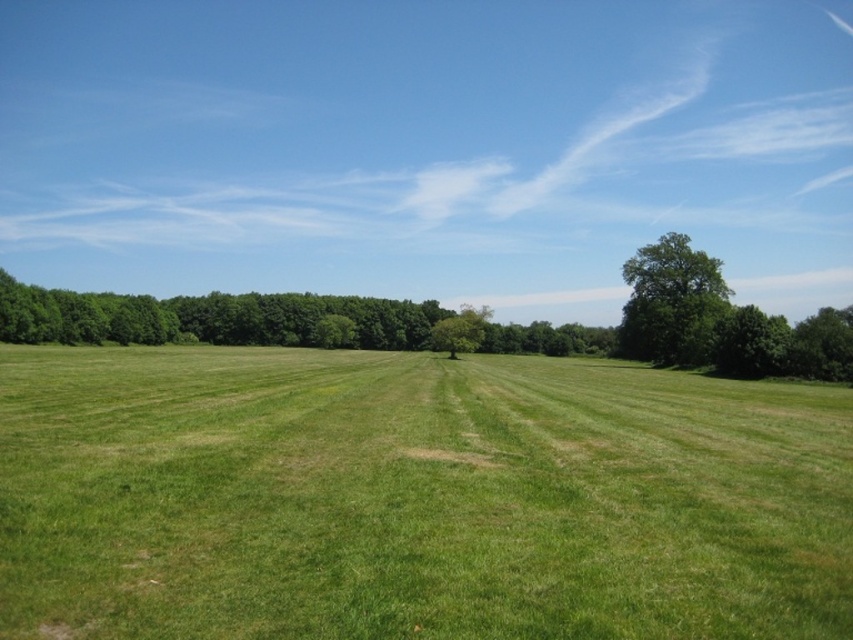
Question: Which of these objects is positioned farthest from the green leafy tree at left?

Choices:
 (A) green grassy field at center
 (B) green leafy tree at right

Answer: (A)

Question: Can you confirm if green leafy tree at left is positioned above green leafy tree at right?

Choices:
 (A) yes
 (B) no

Answer: (A)

Question: Can you confirm if green grassy field at center is positioned above green leafy tree at left?

Choices:
 (A) yes
 (B) no

Answer: (B)

Question: Estimate the real-world distances between objects in this image. Which object is farther from the green leafy tree at right?

Choices:
 (A) green leafy tree at left
 (B) green grassy field at center

Answer: (A)

Question: Can you confirm if green grassy field at center is bigger than green leafy tree at right?

Choices:
 (A) no
 (B) yes

Answer: (A)

Question: Which point is farther to the camera?

Choices:
 (A) pos(55,326)
 (B) pos(672,595)

Answer: (A)